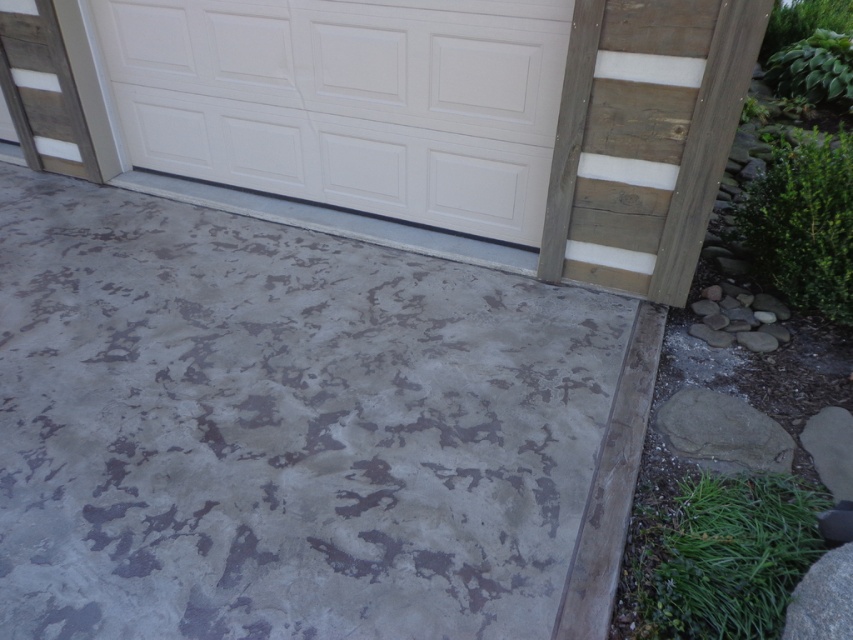
You are standing at the driveway entrance and want to walk to the garage door. Which surface will you step on first? The textured gray concrete at center or the wooden fence to the right?

The textured gray concrete at center is at point (283, 429), so you will step on the textured gray concrete at center first before reaching the wooden fence to the right.